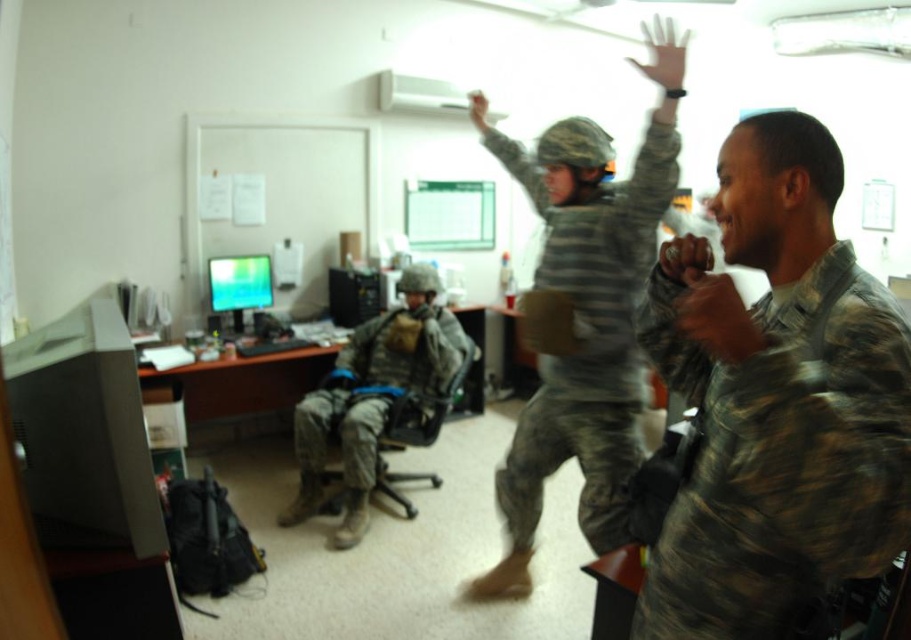
You are a photographer setting up a shot in the military office. You want to capture the camouflagetextured fabric at right clearly. What is the minimum distance you should keep between the camera and the fabric?

The minimum distance you should keep between the camera and the camouflagetextured fabric at right is 29.53 inches to ensure it is in focus.

You are a photographer standing at the back of the room. You want to take a photo of both the camouflage fabric soldier at center and the camouflage uniform at center. Which one will appear larger in your photo?

The camouflage fabric soldier at center will appear larger in the photo because it is closer to the viewer than the camouflage uniform at center.

You are standing in the military office scene. There is a camouflagetextured fabric at right located at point (781, 456). Can you tell me what object is at that coordinate?

The camouflagetextured fabric at right is located at point (781, 456).